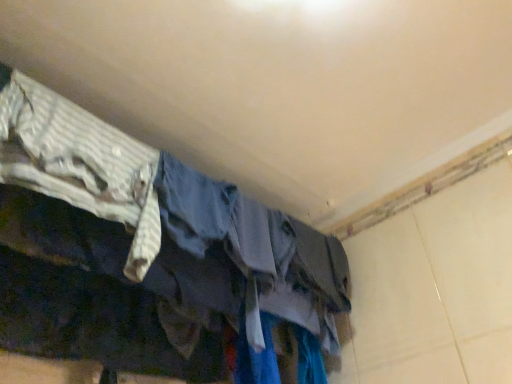
The width and height of the screenshot is (512, 384). I want to click on striped fabric shirt at left, so click(80, 164).

The width and height of the screenshot is (512, 384). Describe the element at coordinates (80, 164) in the screenshot. I see `striped fabric shirt at left` at that location.

Find the location of a particular element. The image size is (512, 384). striped fabric shirt at left is located at coordinates (80, 164).